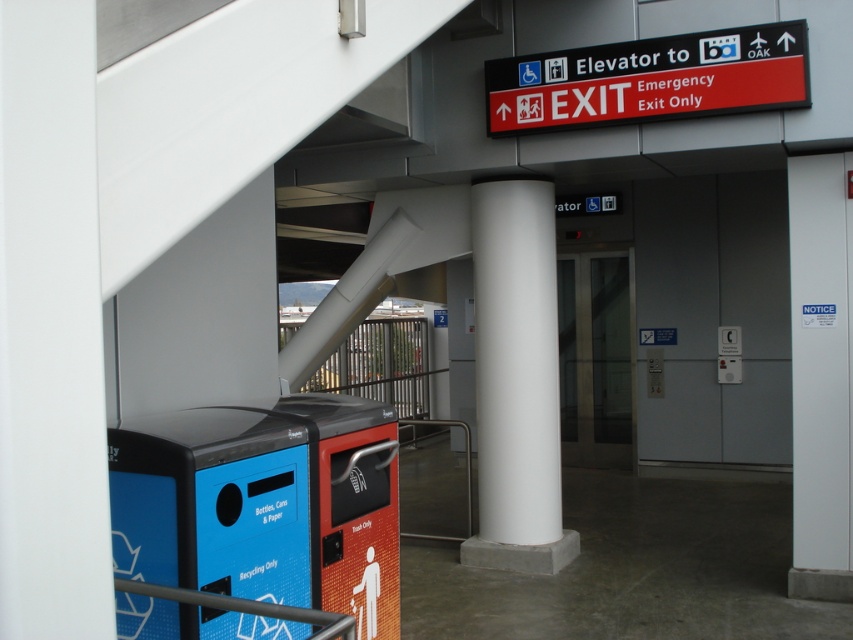
Between white smooth column at center and red plastic sign at upper right, which one is positioned higher?

Positioned higher is red plastic sign at upper right.

Does white smooth column at center have a greater height compared to red plastic sign at upper right?

Yes.

This screenshot has width=853, height=640. I want to click on white smooth column at center, so click(x=515, y=380).